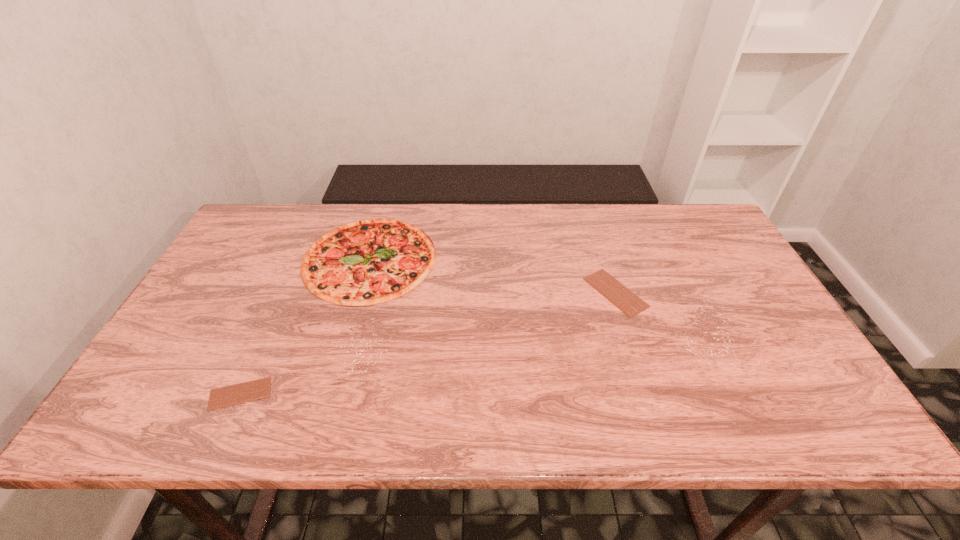
Identify the location of vacant area between the pizza and the shorter chocolate bar. The image size is (960, 540). (305, 326).

Identify the location of free area in between the taller chocolate bar and the tallest object. The height and width of the screenshot is (540, 960). (492, 275).

Where is `free space between the farther chocolate bar and the shortest object`? free space between the farther chocolate bar and the shortest object is located at coordinates (428, 343).

You are a GUI agent. You are given a task and a screenshot of the screen. Output one action in this format:
    pyautogui.click(x=<x>, y=<y>)
    Task: Click on the vacant space that's between the pizza and the taller chocolate bar
    The width and height of the screenshot is (960, 540).
    Given the screenshot: What is the action you would take?
    pyautogui.click(x=492, y=275)

This screenshot has height=540, width=960. I want to click on free space between the right chocolate bar and the shortest object, so click(x=428, y=343).

Identify the location of empty space that is in between the shortest object and the pizza. The width and height of the screenshot is (960, 540). (305, 326).

Where is `free space between the shortest object and the pizza`? This screenshot has height=540, width=960. free space between the shortest object and the pizza is located at coordinates (305, 326).

Locate an element on the screen. The image size is (960, 540). object that is the closest to the pizza is located at coordinates (226, 396).

Identify the location of the second closest object relative to the tallest object. The height and width of the screenshot is (540, 960). (629, 303).

The width and height of the screenshot is (960, 540). What are the coordinates of `vacant position in the image that satisfies the following two spatial constraints: 1. on the back side of the shorter chocolate bar; 2. on the left side of the pizza` in the screenshot? It's located at (301, 259).